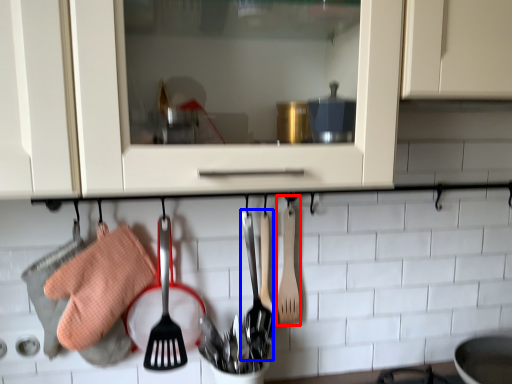
Question: Which of the following is the farthest to the observer, spatula (highlighted by a red box) or silverware (highlighted by a blue box)?

Choices:
 (A) spatula
 (B) silverware

Answer: (A)